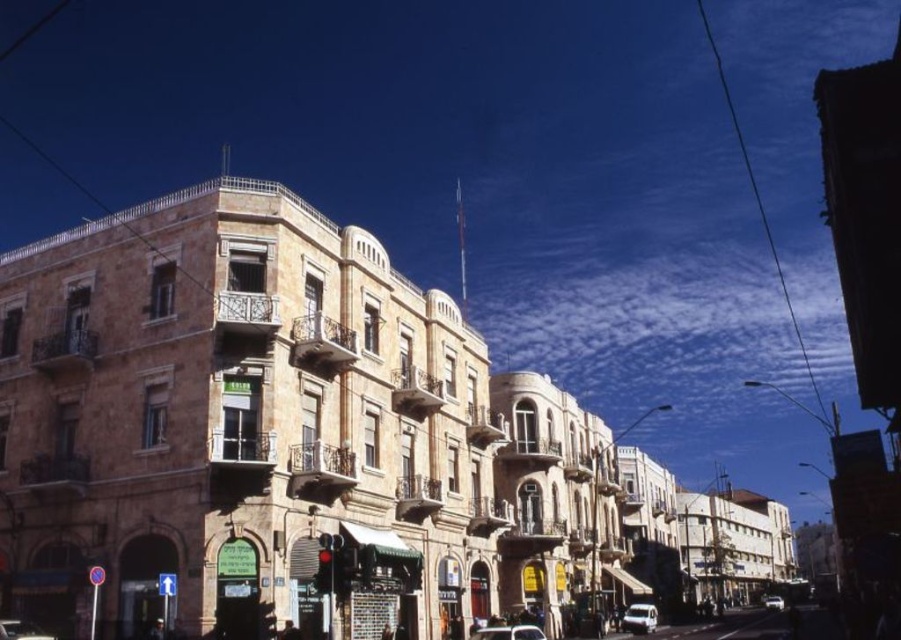
You are a delivery driver who needs to park your vehicle between the white matte van at lower right and the white glossy car at center. Given that your vehicle is 2 meters wide, can you fit your vehicle in the space between them?

The white matte van at lower right has a lesser width compared to white glossy car at center. Since the van is narrower, the space between them may accommodate a 2 meter wide vehicle, but this depends on the total available space between the two vehicles. Without exact distance measurements, it is uncertain if the vehicle will fit.